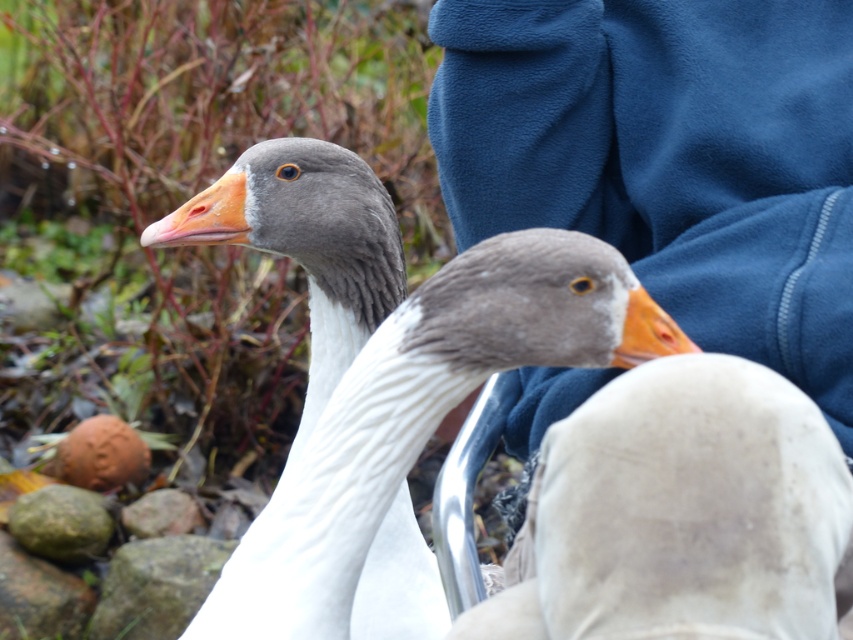
Question: Considering the relative positions of orange matte beak at center and gray rough stone at lower left in the image provided, where is orange matte beak at center located with respect to gray rough stone at lower left?

Choices:
 (A) above
 (B) below

Answer: (A)

Question: Among these objects, which one is nearest to the camera?

Choices:
 (A) blue fleece sweatshirt at upper center
 (B) orange matte beak at center

Answer: (B)

Question: Is the position of brown clay stone at lower left less distant than that of orange matte beak at upper left?

Choices:
 (A) no
 (B) yes

Answer: (A)

Question: Among these points, which one is nearest to the camera?

Choices:
 (A) (242, 225)
 (B) (631, 326)
 (C) (456, 22)
 (D) (44, 515)

Answer: (B)

Question: Considering the relative positions of brown clay stone at lower left and gray rough stone at lower left in the image provided, where is brown clay stone at lower left located with respect to gray rough stone at lower left?

Choices:
 (A) above
 (B) below

Answer: (A)

Question: Which of the following is the closest to the observer?

Choices:
 (A) green rough stone at lower left
 (B) orange matte beak at center
 (C) brown clay stone at lower left
 (D) gray rough rock at lower left

Answer: (B)